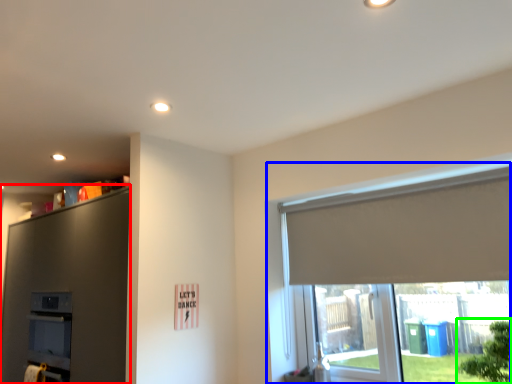
Question: Which is nearer to the dresser (highlighted by a red box)? window (highlighted by a blue box) or tree (highlighted by a green box).

Choices:
 (A) window
 (B) tree

Answer: (A)